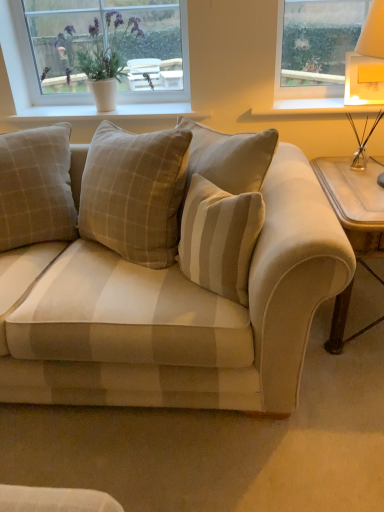
Image resolution: width=384 pixels, height=512 pixels. I want to click on free spot above wooden side table at right (from a real-world perspective), so click(360, 183).